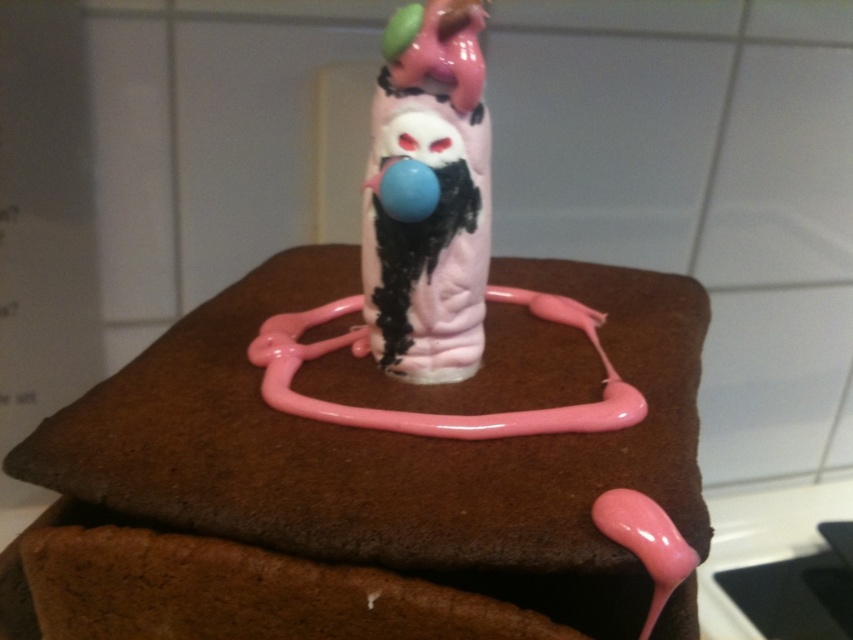
You are looking at a cake with two decorations. There is a matte plastic toy at center and a matte pink plastic figurine at center. Which one is positioned to the right side?

The matte plastic toy at center is positioned to the right of the matte pink plastic figurine at center.

You are holding a camera and want to take a photo of the cake decoration. The camera has a focal length of 35mm and you are currently 34.38 inches away from the point at coordinates point (x=453, y=67). If you want to ensure the decoration is in focus, what is the minimum distance you should maintain from the point?

The minimum distance you should maintain from the point is 34.38 inches, as that is the exact distance between the camera and the point according to the description.

You are planning to place a small sticker on the cake. The sticker is exactly the size of the matte pink plastic figurine at center. Can you fit the sticker on the matte plastic toy at center without overlapping its edges?

The matte plastic toy at center is larger in size than the matte pink plastic figurine at center. Since the sticker is the same size as the figurine, it can fit on the toy without overlapping the edges.